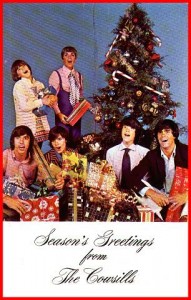
Locate an element on the screen. The height and width of the screenshot is (300, 191). christmas tree is located at coordinates (136, 50).